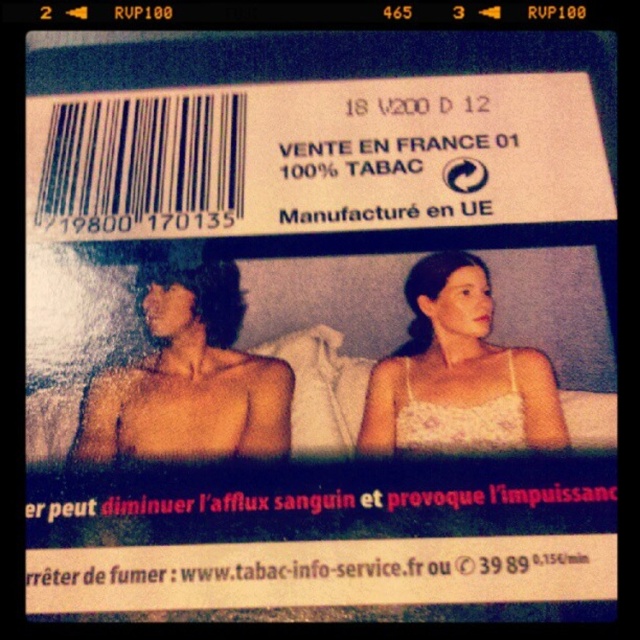
Question: Can you confirm if shiny skin man at center is positioned above white lace dress at center?

Choices:
 (A) yes
 (B) no

Answer: (A)

Question: Which point is farther from the camera taking this photo?

Choices:
 (A) (516, 444)
 (B) (148, 440)

Answer: (B)

Question: Is shiny skin man at center below white lace dress at center?

Choices:
 (A) no
 (B) yes

Answer: (A)

Question: Is shiny skin man at center positioned in front of white lace dress at center?

Choices:
 (A) yes
 (B) no

Answer: (B)

Question: Which object is closer to the camera taking this photo?

Choices:
 (A) shiny skin man at center
 (B) white lace dress at center

Answer: (B)

Question: Which object is farther from the camera taking this photo?

Choices:
 (A) white lace dress at center
 (B) shiny skin man at center

Answer: (B)